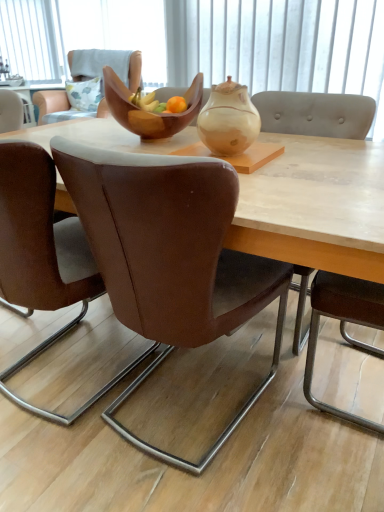
Question: From the image's perspective, would you say brown leather chair at center, arranged as the 3th chair when viewed from the front, is positioned over brown leather chair at center, which appears as the 1th chair when viewed from the back?

Choices:
 (A) yes
 (B) no

Answer: (B)

Question: Does brown leather chair at center, which is the 2th chair from back to front, have a smaller size compared to brown leather chair at center, the 4th chair viewed from the front?

Choices:
 (A) no
 (B) yes

Answer: (B)

Question: Does brown leather chair at center, arranged as the 3th chair when viewed from the front, have a larger size compared to brown leather chair at center, the 4th chair viewed from the front?

Choices:
 (A) yes
 (B) no

Answer: (B)

Question: Is brown leather chair at center, arranged as the 3th chair when viewed from the front, located outside brown leather chair at center, the 4th chair viewed from the front?

Choices:
 (A) yes
 (B) no

Answer: (A)

Question: Can you confirm if brown leather chair at center, arranged as the 3th chair when viewed from the front, is wider than brown leather chair at center, which appears as the 1th chair when viewed from the back?

Choices:
 (A) yes
 (B) no

Answer: (B)

Question: From a real-world perspective, is light gray fabric chair at right, which appears as the 2th chair when viewed from the front, above or below brown leather chair at center, marked as the first chair in a front-to-back arrangement?

Choices:
 (A) above
 (B) below

Answer: (A)

Question: From the image's perspective, relative to brown leather chair at center, acting as the 4th chair starting from the back, is light gray fabric chair at right, which appears as the 2th chair when viewed from the front, above or below?

Choices:
 (A) below
 (B) above

Answer: (B)

Question: Considering the positions of point (294, 353) and point (162, 239), is point (294, 353) closer or farther from the camera than point (162, 239)?

Choices:
 (A) closer
 (B) farther

Answer: (B)

Question: Is light gray fabric chair at right, which appears as the 2th chair when viewed from the front, bigger or smaller than brown leather chair at center, marked as the first chair in a front-to-back arrangement?

Choices:
 (A) small
 (B) big

Answer: (A)

Question: Is matte beige teapot at center taller or shorter than brown leather chair at center, which appears as the 1th chair when viewed from the back?

Choices:
 (A) tall
 (B) short

Answer: (B)

Question: Considering their positions, is matte beige teapot at center located in front of or behind brown leather chair at center, which appears as the 1th chair when viewed from the back?

Choices:
 (A) behind
 (B) front

Answer: (B)

Question: From a real-world perspective, is matte beige teapot at center positioned above or below brown leather chair at center, the 4th chair viewed from the front?

Choices:
 (A) above
 (B) below

Answer: (A)

Question: Considering the positions of matte beige teapot at center and brown leather chair at center, the 4th chair viewed from the front, in the image, is matte beige teapot at center wider or thinner than brown leather chair at center, the 4th chair viewed from the front,?

Choices:
 (A) wide
 (B) thin

Answer: (B)

Question: Considering the positions of point (173, 273) and point (87, 51), is point (173, 273) closer or farther from the camera than point (87, 51)?

Choices:
 (A) closer
 (B) farther

Answer: (A)

Question: Is brown leather chair at center, marked as the first chair in a front-to-back arrangement, spatially inside brown leather chair at center, which appears as the 1th chair when viewed from the back, or outside of it?

Choices:
 (A) outside
 (B) inside

Answer: (A)